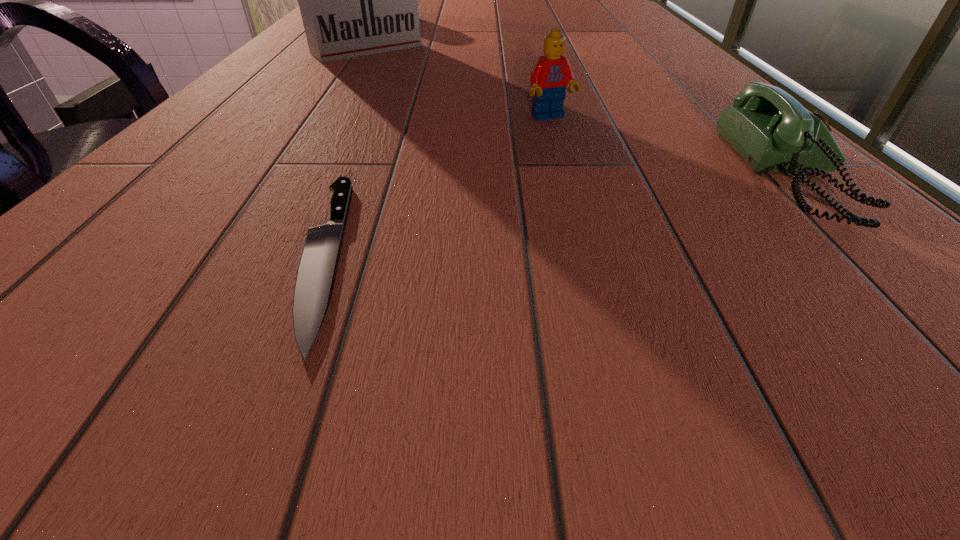
I want to click on vacant space at the near edge of the desktop, so click(x=458, y=253).

I want to click on vacant region at the left edge of the desktop, so click(327, 76).

This screenshot has height=540, width=960. I want to click on free location at the right edge, so click(628, 42).

Image resolution: width=960 pixels, height=540 pixels. In the image, there is a desktop. Identify the location of blank space at the near left corner. (162, 259).

The height and width of the screenshot is (540, 960). What are the coordinates of `vacant space at the near right corner of the desktop` in the screenshot? It's located at (854, 238).

Where is `free point between the shortest object and the second shortest object`? The image size is (960, 540). free point between the shortest object and the second shortest object is located at coordinates tap(558, 217).

At what (x,y) coordinates should I click in order to perform the action: click on vacant point located between the tallest object and the third object from left to right. Please return your answer as a coordinate pair (x, y). The width and height of the screenshot is (960, 540). Looking at the image, I should click on (458, 83).

Where is `free point between the steak knife and the tallest object`? Image resolution: width=960 pixels, height=540 pixels. free point between the steak knife and the tallest object is located at coordinates (345, 152).

Identify the location of vacant region between the third tallest object and the third shortest object. The height and width of the screenshot is (540, 960). (671, 148).

Image resolution: width=960 pixels, height=540 pixels. I want to click on blank region between the rightmost object and the shortest object, so click(558, 217).